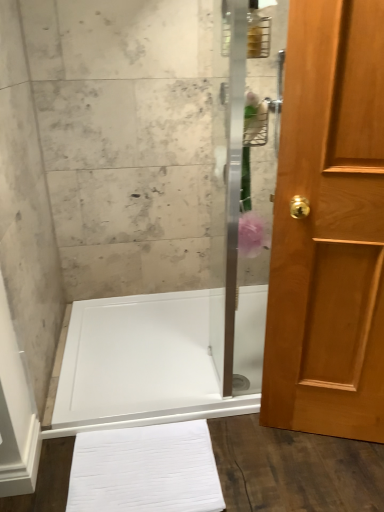
Question: Does clear glass shower door at center appear on the right side of light brown wood door at right?

Choices:
 (A) no
 (B) yes

Answer: (A)

Question: Would you say clear glass shower door at center is a long distance from light brown wood door at right?

Choices:
 (A) yes
 (B) no

Answer: (B)

Question: Is clear glass shower door at center positioned with its back to light brown wood door at right?

Choices:
 (A) yes
 (B) no

Answer: (B)

Question: Does clear glass shower door at center have a lesser width compared to light brown wood door at right?

Choices:
 (A) yes
 (B) no

Answer: (A)

Question: Is clear glass shower door at center bigger than light brown wood door at right?

Choices:
 (A) no
 (B) yes

Answer: (A)

Question: Is clear glass shower door at center positioned in front of light brown wood door at right?

Choices:
 (A) yes
 (B) no

Answer: (B)

Question: From a real-world perspective, does white glossy shower tray at center sit lower than white cotton bath towel at lower center?

Choices:
 (A) yes
 (B) no

Answer: (B)

Question: From the image's perspective, does white glossy shower tray at center appear higher than white cotton bath towel at lower center?

Choices:
 (A) no
 (B) yes

Answer: (B)

Question: Is white glossy shower tray at center located outside white cotton bath towel at lower center?

Choices:
 (A) yes
 (B) no

Answer: (A)

Question: Is white glossy shower tray at center beside white cotton bath towel at lower center?

Choices:
 (A) no
 (B) yes

Answer: (A)

Question: Considering the relative sizes of white glossy shower tray at center and white cotton bath towel at lower center in the image provided, is white glossy shower tray at center bigger than white cotton bath towel at lower center?

Choices:
 (A) yes
 (B) no

Answer: (A)

Question: Does white glossy shower tray at center come behind white cotton bath towel at lower center?

Choices:
 (A) yes
 (B) no

Answer: (A)

Question: Is white glossy shower tray at center in contact with light brown wood door at right?

Choices:
 (A) yes
 (B) no

Answer: (B)